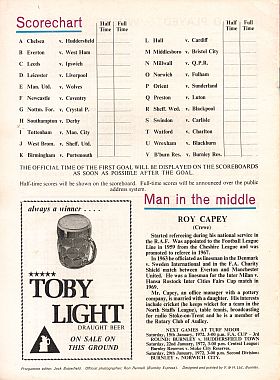
This screenshot has height=380, width=280. I want to click on cup, so click(x=68, y=254).